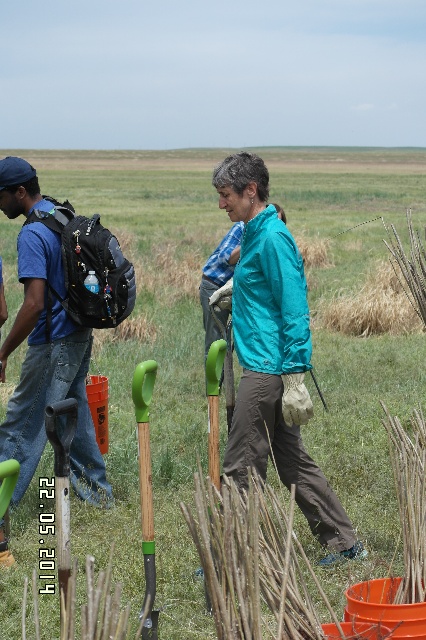
Question: Among these points, which one is farthest from the camera?

Choices:
 (A) (273, 268)
 (B) (57, 371)

Answer: (B)

Question: Is teal fabric jacket at center to the right of matte black backpack at left from the viewer's perspective?

Choices:
 (A) yes
 (B) no

Answer: (A)

Question: Which of these objects is positioned closest to the green wood shovel at center?

Choices:
 (A) teal fabric jacket at center
 (B) matte black backpack at left

Answer: (A)

Question: Which object is positioned closest to the teal fabric jacket at center?

Choices:
 (A) green wood shovel at center
 (B) matte black backpack at left

Answer: (A)

Question: In this image, where is matte black backpack at left located relative to green wood shovel at center?

Choices:
 (A) right
 (B) left

Answer: (B)

Question: Can you confirm if teal fabric jacket at center is positioned to the right of green wood shovel at center?

Choices:
 (A) no
 (B) yes

Answer: (B)